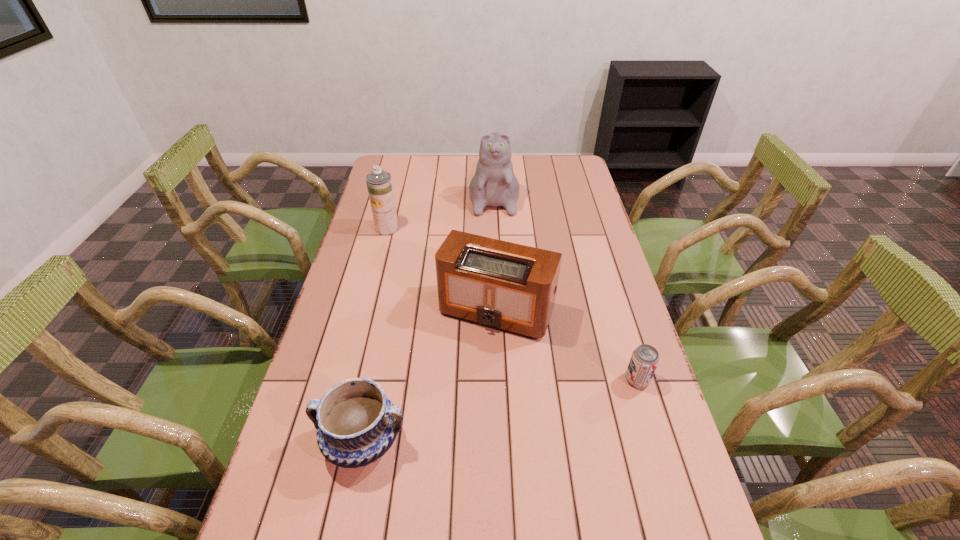
I want to click on free spot that satisfies the following two spatial constraints: 1. on the face of the beer can; 2. on the right side of the cat, so click(x=501, y=380).

This screenshot has height=540, width=960. Find the location of `vacant space that satisfies the following two spatial constraints: 1. on the front side of the shortest object; 2. on the left side of the third farthest object`. vacant space that satisfies the following two spatial constraints: 1. on the front side of the shortest object; 2. on the left side of the third farthest object is located at coordinates (499, 380).

At what (x,y) coordinates should I click in order to perform the action: click on vacant space that satisfies the following two spatial constraints: 1. on the face of the rightmost object; 2. on the right side of the cat. Please return your answer as a coordinate pair (x, y). This screenshot has width=960, height=540. Looking at the image, I should click on (501, 380).